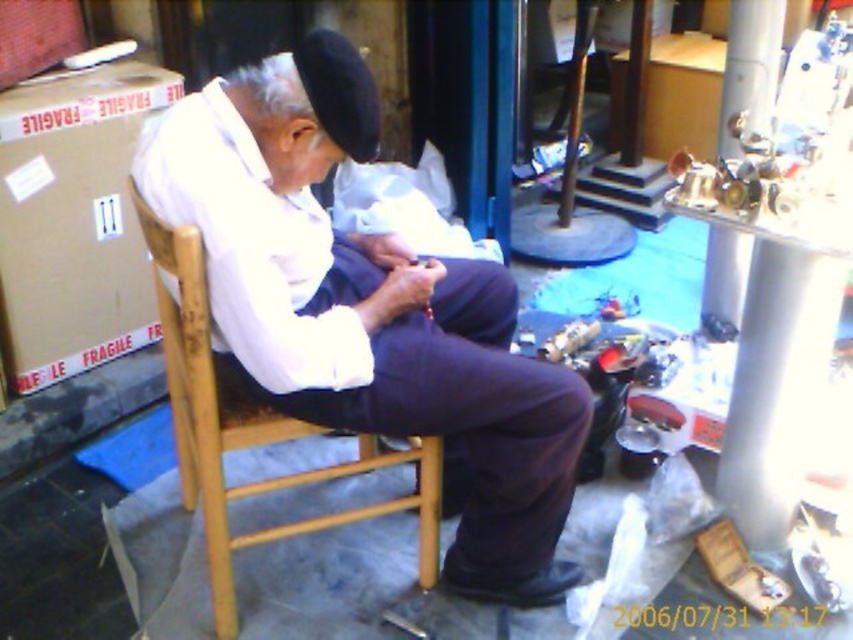
Question: Estimate the real-world distances between objects in this image. Which object is closer to the white matte shirt at center?

Choices:
 (A) navy felt hat at upper center
 (B) metallic silver pole at right

Answer: (A)

Question: Among these points, which one is farthest from the camera?

Choices:
 (A) (201, 410)
 (B) (308, 378)
 (C) (137, 285)

Answer: (C)

Question: Based on their relative distances, which object is farther from the navy felt hat at upper center?

Choices:
 (A) white matte shirt at center
 (B) metallic silver pole at right
 (C) wooden chair at center

Answer: (B)

Question: Can you confirm if wooden chair at center is positioned above navy felt hat at upper center?

Choices:
 (A) yes
 (B) no

Answer: (B)

Question: Is wooden chair at center to the right of metallic silver pole at right from the viewer's perspective?

Choices:
 (A) yes
 (B) no

Answer: (B)

Question: Is brown cardboard box at left to the left of metallic silver pole at right from the viewer's perspective?

Choices:
 (A) no
 (B) yes

Answer: (B)